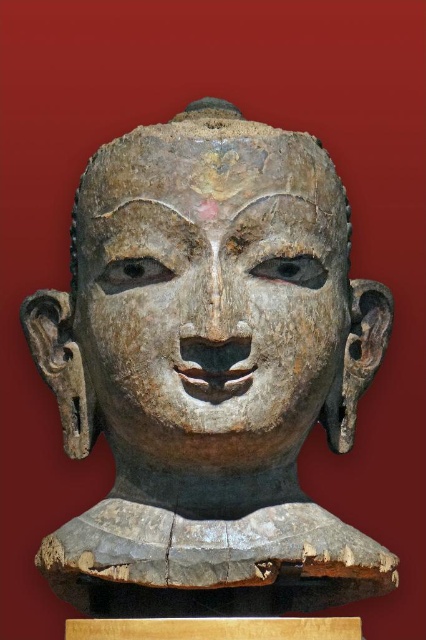
Question: Among these points, which one is farthest from the camera?

Choices:
 (A) (259, 241)
 (B) (333, 344)

Answer: (B)

Question: Where is weathered wood head at center located in relation to weathered wood face at center in the image?

Choices:
 (A) right
 (B) left

Answer: (B)

Question: Can you confirm if weathered wood head at center is smaller than weathered wood face at center?

Choices:
 (A) yes
 (B) no

Answer: (B)

Question: Considering the relative positions of weathered wood head at center and weathered wood face at center in the image provided, where is weathered wood head at center located with respect to weathered wood face at center?

Choices:
 (A) left
 (B) right

Answer: (A)

Question: Which point is closer to the camera taking this photo?

Choices:
 (A) (213, 372)
 (B) (69, 573)

Answer: (A)